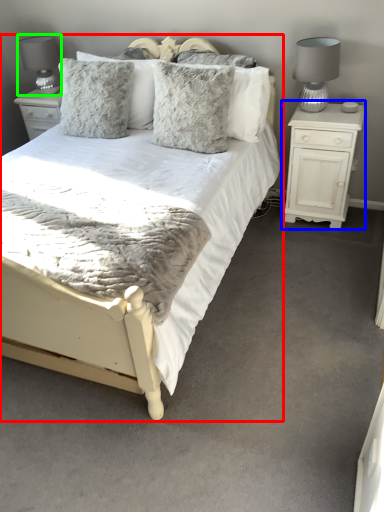
Question: Based on their relative distances, which object is farther from bed (highlighted by a red box)? Choose from nightstand (highlighted by a blue box) and table lamp (highlighted by a green box).

Choices:
 (A) nightstand
 (B) table lamp

Answer: (B)